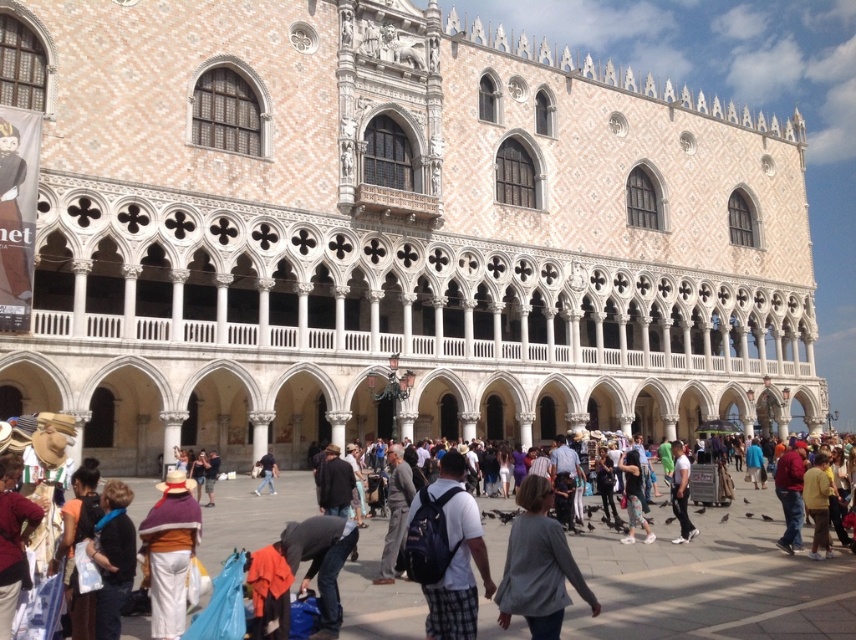
Question: Which of the following is the closest to the observer?

Choices:
 (A) gray cotton sweater at center
 (B) denim jacket at center

Answer: (A)

Question: Is white stone building at center wider than gray cotton sweater at center?

Choices:
 (A) no
 (B) yes

Answer: (B)

Question: Can you confirm if gray cotton sweater at center is positioned to the left of dark gray sweater at lower left?

Choices:
 (A) no
 (B) yes

Answer: (A)

Question: Among these objects, which one is nearest to the camera?

Choices:
 (A) gray cotton sweater at center
 (B) white stone building at center

Answer: (A)

Question: Is gray cotton sweater at center thinner than denim jacket at center?

Choices:
 (A) no
 (B) yes

Answer: (A)

Question: Considering the real-world distances, which object is farthest from the gray cotton sweater at center?

Choices:
 (A) dark gray sweater at lower left
 (B) white stone building at center

Answer: (B)